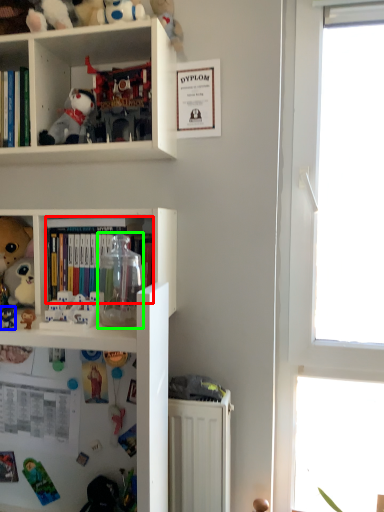
Question: Considering the real-world distances, which object is closest to book (highlighted by a red box)? toy (highlighted by a blue box) or glass jar (highlighted by a green box).

Choices:
 (A) toy
 (B) glass jar

Answer: (B)